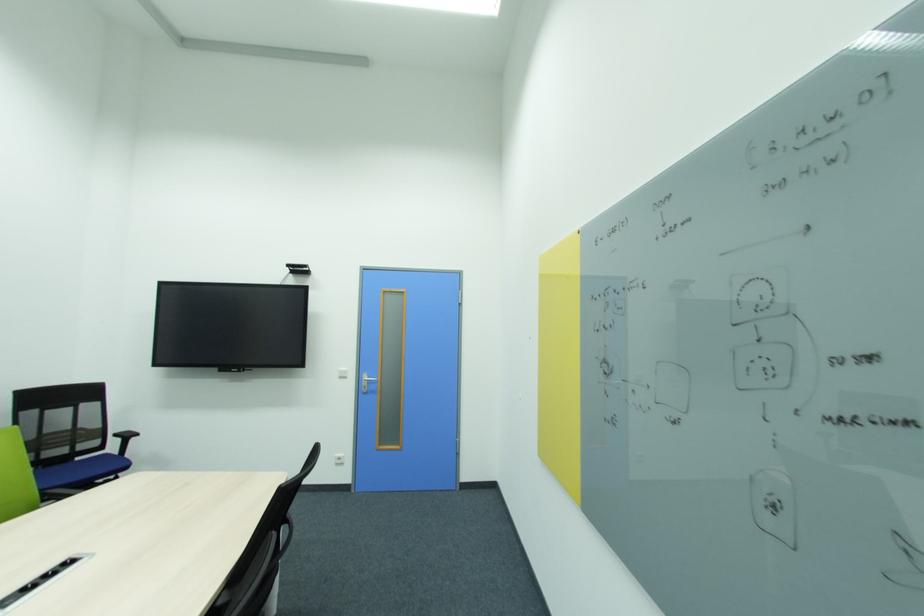
What do you see at coordinates (377, 390) in the screenshot? I see `a silver door handle` at bounding box center [377, 390].